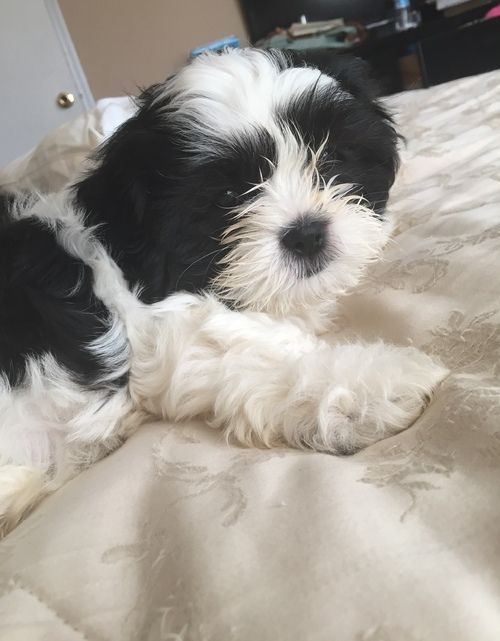
This screenshot has width=500, height=641. In order to click on computer desk in this screenshot , I will do `click(332, 40)`.